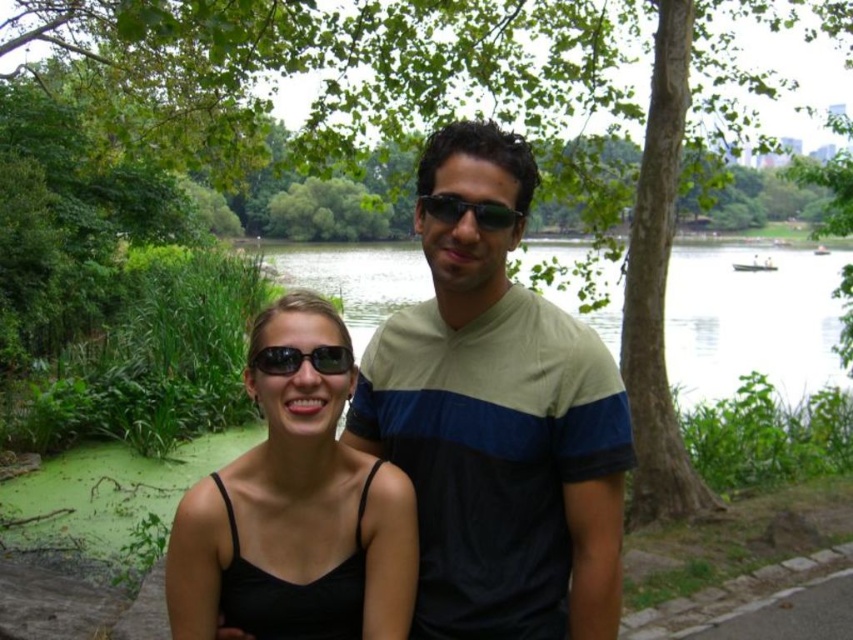
Is black matte tank top at center positioned before black reflective sunglasses at center?

Yes, black matte tank top at center is closer to the viewer.

Does black matte tank top at center have a smaller size compared to black reflective sunglasses at center?

Actually, black matte tank top at center might be larger than black reflective sunglasses at center.

Image resolution: width=853 pixels, height=640 pixels. I want to click on black matte tank top at center, so point(294,513).

I want to click on black matte tank top at center, so click(x=294, y=513).

Is black reflective sunglasses at center behind black plastic sunglasses at center?

No.

Between black reflective sunglasses at center and black plastic sunglasses at center, which one has less height?

black reflective sunglasses at center

Which is in front, point (265, 358) or point (447, 195)?

Point (265, 358)

Locate an element on the screen. This screenshot has height=640, width=853. black reflective sunglasses at center is located at coordinates (300, 358).

Who is lower down, black matte tank top at center or green algae water at center?

black matte tank top at center is lower down.

Does point (380, 568) lie in front of point (727, 314)?

Yes, point (380, 568) is in front of point (727, 314).

This screenshot has width=853, height=640. What are the coordinates of `black matte tank top at center` in the screenshot? It's located at (294, 513).